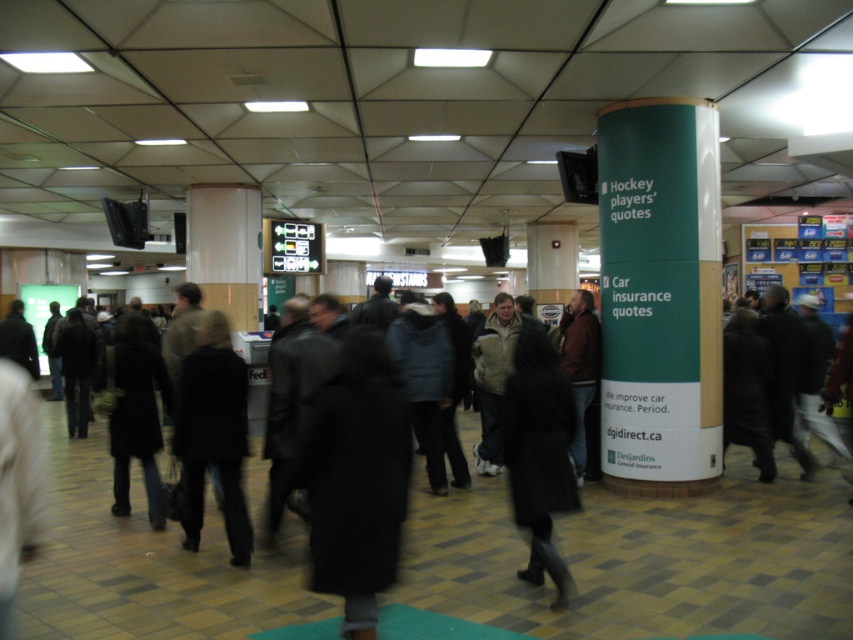
You are a person who is 1.7 meters tall. You are standing in the scene and want to read the text on the green matte sign at right and the dark wool coat at left. Which object will you need to look up more to see the top of it?

The green matte sign at right has a greater height compared to the dark wool coat at left, so you will need to look up more to see the top of the green matte sign at right.

You are a delivery person carrying a large package that is 2 meters in length. You need to navigate through the space between the green matte sign at right and the black wool coat at center. Is there enough space for your package to pass through without touching either object?

The distance between the green matte sign at right and the black wool coat at center is 3.74 meters. Since your package is 2 meters long, there is sufficient space for it to pass through without touching either object.

What is the relationship between the width of the green matte sign at right and the dark wool coat at left in the scene?

The green matte sign at right might be wider than dark wool coat at left.